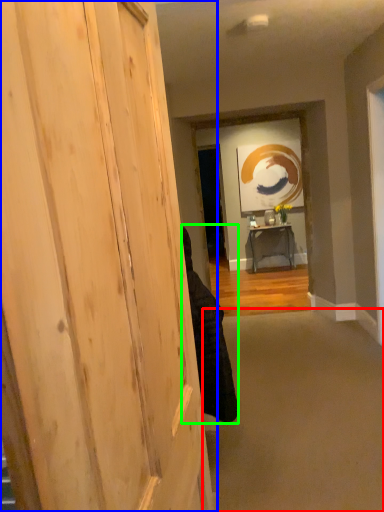
Question: Which object is the farthest from plain (highlighted by a red box)? Choose among these: door (highlighted by a blue box) or person (highlighted by a green box).

Choices:
 (A) door
 (B) person

Answer: (A)